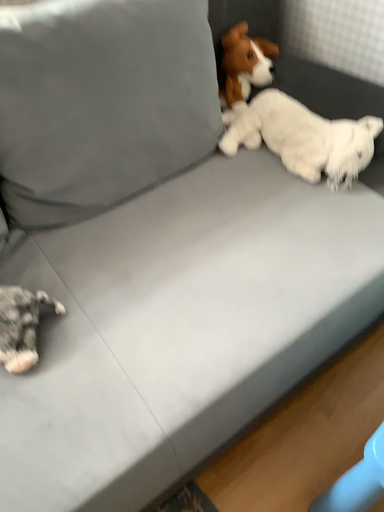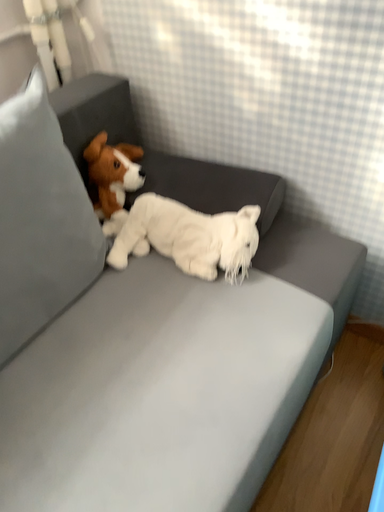
Question: How did the camera likely rotate when shooting the video?

Choices:
 (A) rotated right
 (B) rotated left

Answer: (A)